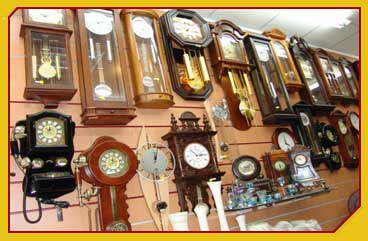
Locate an element on the screen. The image size is (368, 241). reddish brown clock is located at coordinates (120, 181).